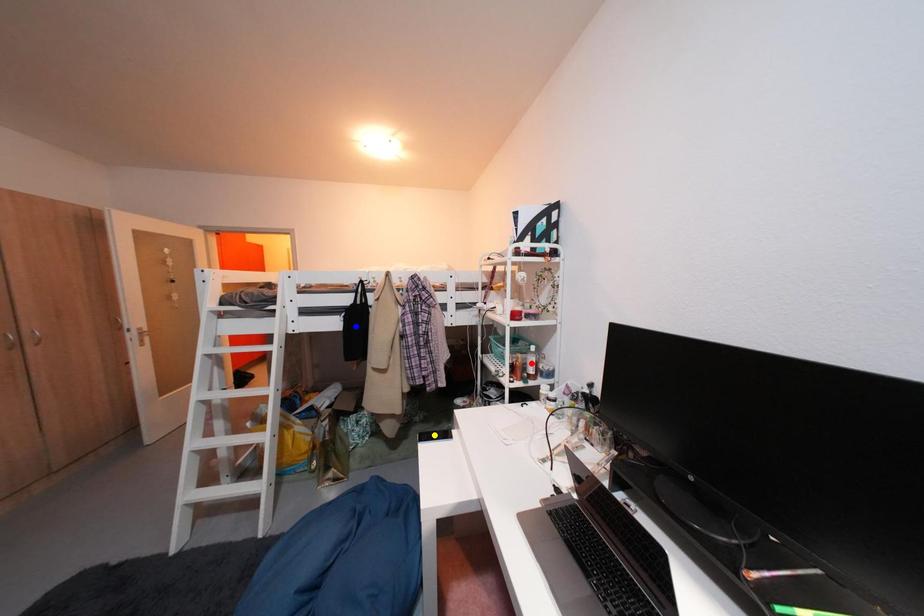
Order these from nearest to farthest:
blue point
yellow point
red point

red point → blue point → yellow point